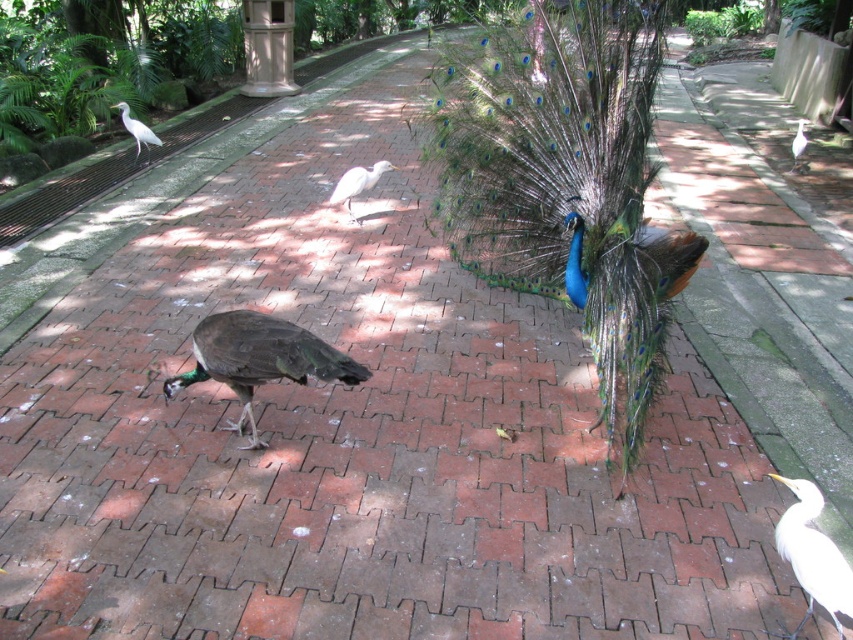
You are standing in the park and see two points marked on the ground. The first point is at coordinates point (630, 173) and the second is at point (345, 172). Which point is closer to you?

Point (630, 173) is in front of point (345, 172), so the first point is closer to you.

You are a photographer standing in the park and want to capture both the shiny green peacock at center and the white matte bird at lower right in the same frame. Which bird should you focus on first to ensure both are in the shot?

You should focus on the shiny green peacock at center first because it is located above the white matte bird at lower right, so adjusting the camera angle to include the upper subject ensures the lower one will also be captured.